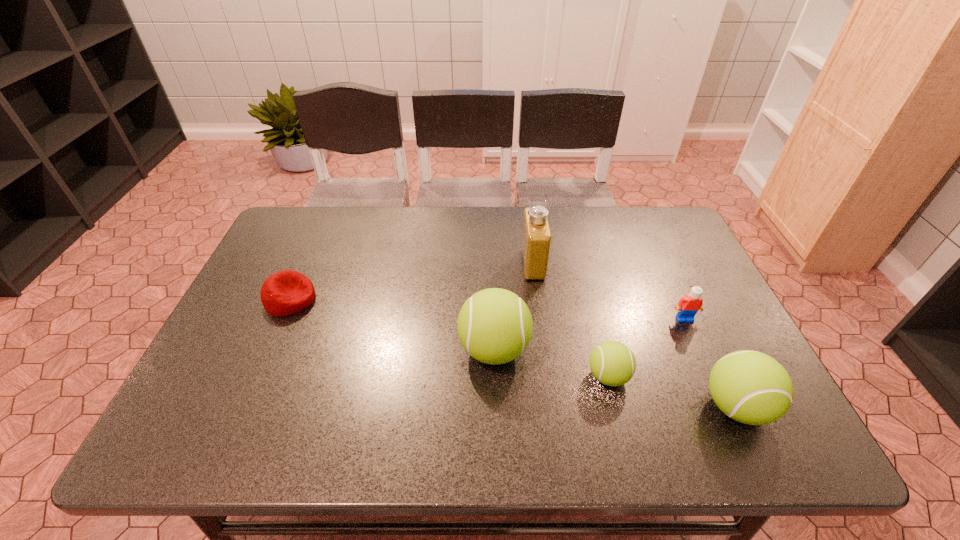
Locate an element on the screen. The height and width of the screenshot is (540, 960). tennis ball present at the right edge is located at coordinates (750, 387).

Locate an element on the screen. Image resolution: width=960 pixels, height=540 pixels. Lego present at the right edge is located at coordinates click(688, 306).

Locate an element on the screen. object present at the near right corner is located at coordinates (750, 387).

Find the location of a particular element. The height and width of the screenshot is (540, 960). vacant space at the far edge of the desktop is located at coordinates click(x=633, y=242).

The image size is (960, 540). I want to click on vacant region at the near edge of the desktop, so click(562, 404).

The height and width of the screenshot is (540, 960). Find the location of `vacant space at the left edge`. vacant space at the left edge is located at coordinates (310, 260).

Where is `vacant space at the right edge of the desktop`? vacant space at the right edge of the desktop is located at coordinates (675, 254).

You are a GUI agent. You are given a task and a screenshot of the screen. Output one action in this format:
    pyautogui.click(x=<x>, y=<y>)
    Task: Click on the free space at the far left corner of the desktop
    This screenshot has width=960, height=540.
    Given the screenshot: What is the action you would take?
    pyautogui.click(x=307, y=219)

The width and height of the screenshot is (960, 540). Find the location of `blank space at the near left corner of the desktop`. blank space at the near left corner of the desktop is located at coordinates pos(227,381).

Locate an element on the screen. This screenshot has height=540, width=960. vacant space at the far right corner of the desktop is located at coordinates (641, 240).